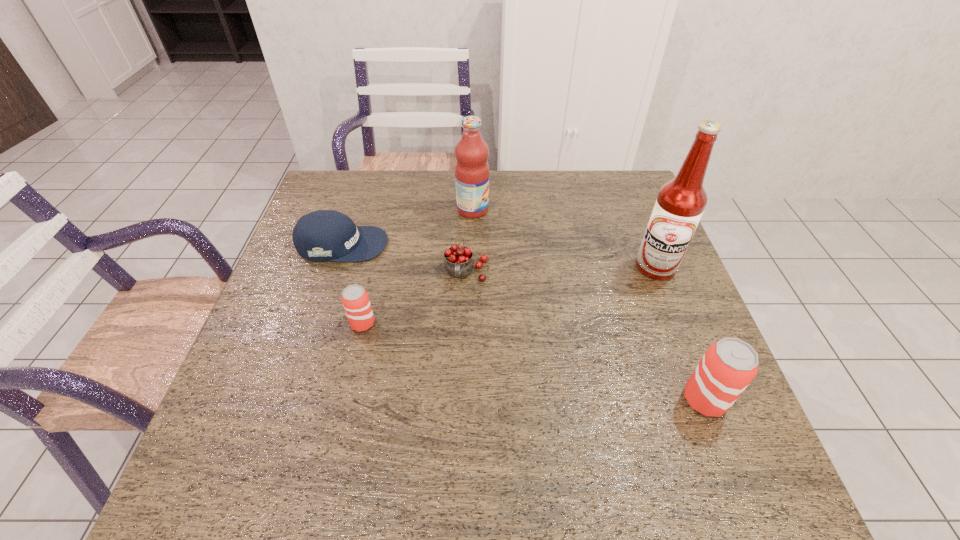
Locate an element on the screen. The height and width of the screenshot is (540, 960). free space that is in between the baseball cap and the alcohol is located at coordinates (499, 256).

What are the coordinates of `vacant area between the farthest object and the taller beer can` in the screenshot? It's located at (588, 305).

Identify the location of vacant space in between the fruit juice and the taller beer can. This screenshot has width=960, height=540. 588,305.

Locate an element on the screen. The image size is (960, 540). free spot between the nearer beer can and the cherry is located at coordinates (586, 336).

The width and height of the screenshot is (960, 540). Identify the location of free space between the cherry and the taller beer can. (586, 336).

You are a GUI agent. You are given a task and a screenshot of the screen. Output one action in this format:
    pyautogui.click(x=<x>, y=<y>)
    Task: Click on the free space that is in between the cherry and the baseball cap
    The width and height of the screenshot is (960, 540).
    Given the screenshot: What is the action you would take?
    pyautogui.click(x=404, y=259)

In order to click on vacant area that lies between the alcohol and the nearest object in this screenshot , I will do `click(680, 334)`.

Find the location of a particular element. This screenshot has height=540, width=960. free point between the tallest object and the fruit juice is located at coordinates (564, 238).

Point out which object is positioned as the third nearest to the nearest object. Please provide its 2D coordinates. Your answer should be formatted as a tuple, i.e. [(x, y)], where the tuple contains the x and y coordinates of a point satisfying the conditions above.

[(471, 170)]

Locate an element on the screen. object that ranks as the fifth closest to the second tallest object is located at coordinates (728, 366).